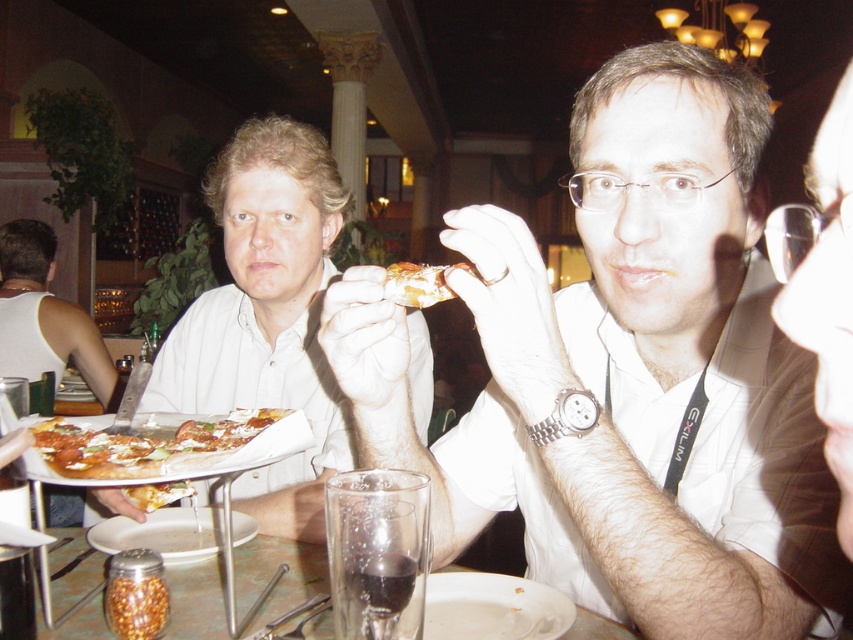
Who is higher up, white matte shirt at upper left or golden crispy pizza slice at center?

Positioned higher is white matte shirt at upper left.

Consider the image. Who is positioned more to the right, white matte shirt at upper left or golden crispy pizza slice at center?

Positioned to the right is golden crispy pizza slice at center.

This screenshot has width=853, height=640. I want to click on white matte shirt at upper left, so click(44, 312).

Can you confirm if matte white shirt at center is positioned above cheesy pizza at center?

Indeed, matte white shirt at center is positioned over cheesy pizza at center.

Between point (784, 497) and point (80, 435), which one is positioned in front?

Point (784, 497) is in front.

Between point (577, 522) and point (241, 461), which one is positioned in front?

Positioned in front is point (577, 522).

Find the location of a particular element. Image resolution: width=853 pixels, height=640 pixels. matte white shirt at center is located at coordinates (627, 376).

Is matte white shirt at center smaller than white matte plate at lower center?

Incorrect, matte white shirt at center is not smaller in size than white matte plate at lower center.

Consider the image. Between matte white shirt at center and white matte plate at lower center, which one has more height?

matte white shirt at center

Where is `matte white shirt at center`? This screenshot has height=640, width=853. matte white shirt at center is located at coordinates (627, 376).